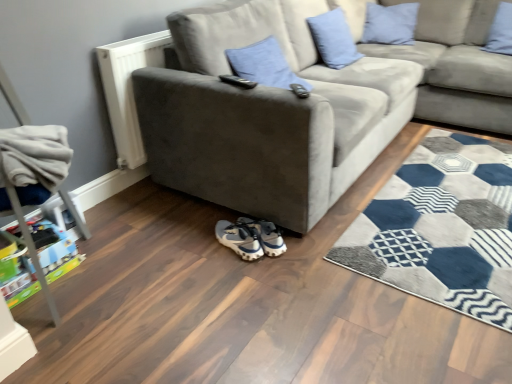
The image size is (512, 384). Describe the element at coordinates (264, 65) in the screenshot. I see `blue fabric pillow at upper center, arranged as the first pillow when viewed from the left` at that location.

Where is `blue fabric pillow at upper center, the fourth pillow viewed from the right`? This screenshot has width=512, height=384. blue fabric pillow at upper center, the fourth pillow viewed from the right is located at coordinates (264, 65).

The width and height of the screenshot is (512, 384). Find the location of `white matte radiator at left`. white matte radiator at left is located at coordinates (128, 89).

Where is `suede gray couch at center`? The height and width of the screenshot is (384, 512). suede gray couch at center is located at coordinates (309, 101).

Looking at this image, how much space does light blue fabric pillow at upper center, positioned as the third pillow in right-to-left order, occupy horizontally?

11.59 inches.

Locate an element on the screen. Image resolution: width=512 pixels, height=384 pixels. white fabric sandal at lower center, which ranks as the 1th footwear in left-to-right order is located at coordinates (239, 239).

Looking at their sizes, would you say light blue fabric pillow at upper center, arranged as the second pillow when viewed from the left, is wider or thinner than suede gray couch at upper right?

Clearly, light blue fabric pillow at upper center, arranged as the second pillow when viewed from the left, has less width compared to suede gray couch at upper right.

Can you confirm if light blue fabric pillow at upper center, arranged as the second pillow when viewed from the left, is smaller than suede gray couch at upper right?

Indeed, light blue fabric pillow at upper center, arranged as the second pillow when viewed from the left, has a smaller size compared to suede gray couch at upper right.

Is point (347, 38) farther from camera compared to point (482, 24)?

No.

Is blue fabric pillow at upper center, the fourth pillow viewed from the right, oriented towards black plastic remote control at upper center, acting as the 1th remote control starting from the left?

No, blue fabric pillow at upper center, the fourth pillow viewed from the right, is not oriented towards black plastic remote control at upper center, acting as the 1th remote control starting from the left.

Which object is thinner, blue fabric pillow at upper center, the fourth pillow viewed from the right, or black plastic remote control at upper center, the second remote control in the right-to-left sequence?

black plastic remote control at upper center, the second remote control in the right-to-left sequence.

I want to click on the 1st pillow to the right of the black plastic remote control at upper center, acting as the 1th remote control starting from the left, starting your count from the anchor, so click(x=264, y=65).

From the image's perspective, is blue fabric pillow at upper center, the fourth pillow viewed from the right, below black plastic remote control at upper center, the second remote control in the right-to-left sequence?

Actually, blue fabric pillow at upper center, the fourth pillow viewed from the right, appears above black plastic remote control at upper center, the second remote control in the right-to-left sequence, in the image.

From the image's perspective, is blue fabric pillow at upper center, the fourth pillow viewed from the right, on top of suede gray couch at center?

No, from the image's perspective, blue fabric pillow at upper center, the fourth pillow viewed from the right, is not on top of suede gray couch at center.

Which is more to the left, blue fabric pillow at upper center, arranged as the first pillow when viewed from the left, or suede gray couch at center?

From the viewer's perspective, blue fabric pillow at upper center, arranged as the first pillow when viewed from the left, appears more on the left side.

Is blue fabric pillow at upper center, the fourth pillow viewed from the right, not within suede gray couch at center?

No, blue fabric pillow at upper center, the fourth pillow viewed from the right, is not entirely external to suede gray couch at center.

How far apart are blue fabric pillow at upper center, arranged as the first pillow when viewed from the left, and suede gray couch at center?

blue fabric pillow at upper center, arranged as the first pillow when viewed from the left, and suede gray couch at center are 14.14 inches apart.

Based on the photo, from a real-world perspective, is blue fabric pillow at upper center, the fourth pillow viewed from the right, over suede gray couch at upper right?

Yes, from a real-world perspective, blue fabric pillow at upper center, the fourth pillow viewed from the right, is over suede gray couch at upper right

Where is `couch above the blue fabric pillow at upper center, the fourth pillow viewed from the right (from the image's perspective)`? This screenshot has width=512, height=384. couch above the blue fabric pillow at upper center, the fourth pillow viewed from the right (from the image's perspective) is located at coordinates (457, 65).

Can you confirm if blue fabric pillow at upper center, arranged as the first pillow when viewed from the left, is wider than suede gray couch at upper right?

No, blue fabric pillow at upper center, arranged as the first pillow when viewed from the left, is not wider than suede gray couch at upper right.

Are blue fabric pillow at upper center, the fourth pillow viewed from the right, and suede gray couch at upper right located far from each other?

blue fabric pillow at upper center, the fourth pillow viewed from the right, is positioned a significant distance from suede gray couch at upper right.

Between white fabric sandal at lower center, the 2th footwear viewed from the right, and plastic toy car at lower left, which one appears on the right side from the viewer's perspective?

From the viewer's perspective, white fabric sandal at lower center, the 2th footwear viewed from the right, appears more on the right side.

Is white fabric sandal at lower center, which ranks as the 1th footwear in left-to-right order, placed right next to plastic toy car at lower left?

No, white fabric sandal at lower center, which ranks as the 1th footwear in left-to-right order, is not with plastic toy car at lower left.

From a real-world perspective, starting from the suede gray couch at center, which pillow is the 4th one vertically above it? Please provide its 2D coordinates.

[(500, 31)]

From the picture: Considering the sizes of blue velvet pillow at upper right, the fourth pillow in the left-to-right sequence, and suede gray couch at center in the image, is blue velvet pillow at upper right, the fourth pillow in the left-to-right sequence, bigger or smaller than suede gray couch at center?

Clearly, blue velvet pillow at upper right, the fourth pillow in the left-to-right sequence, is smaller in size than suede gray couch at center.

Does point (492, 27) lie behind point (250, 210)?

Yes, it is behind point (250, 210).

Which of these two, blue velvet pillow at upper right, the 1th pillow in the right-to-left sequence, or suede gray couch at center, stands shorter?

blue velvet pillow at upper right, the 1th pillow in the right-to-left sequence, is shorter.

Which object is positioned more to the left, suede gray couch at center or black plastic remote control at upper center, acting as the 1th remote control starting from the left?

Positioned to the left is black plastic remote control at upper center, acting as the 1th remote control starting from the left.

Is suede gray couch at center oriented away from black plastic remote control at upper center, acting as the 1th remote control starting from the left?

No, suede gray couch at center's orientation is not away from black plastic remote control at upper center, acting as the 1th remote control starting from the left.

From a real-world perspective, which object stands above the other?

black plastic remote control at upper center, the second remote control in the right-to-left sequence.

Does suede gray couch at center have a lesser width compared to black plastic remote control at upper center, the second remote control in the right-to-left sequence?

In fact, suede gray couch at center might be wider than black plastic remote control at upper center, the second remote control in the right-to-left sequence.

In the image, there is a light blue fabric pillow at upper center, arranged as the second pillow when viewed from the left. Where is `couch below it (from a real-world perspective)`? This screenshot has height=384, width=512. couch below it (from a real-world perspective) is located at coordinates (457, 65).

Where is `remote control that is the 2nd object above the blue fabric pillow at upper center, arranged as the first pillow when viewed from the left (from a real-world perspective)`? remote control that is the 2nd object above the blue fabric pillow at upper center, arranged as the first pillow when viewed from the left (from a real-world perspective) is located at coordinates (238, 81).

Considering their positions, is blue fabric pillow at upper center, the fourth pillow viewed from the right, positioned further to blue velvet pillow at upper right, the 1th pillow in the right-to-left sequence, than plastic toy car at lower left?

plastic toy car at lower left.

Considering their positions, is white fabric sneakers at lower center, positioned as the 1th footwear in right-to-left order, positioned closer to suede gray couch at upper right than plastic toy car at lower left?

The object closer to suede gray couch at upper right is white fabric sneakers at lower center, positioned as the 1th footwear in right-to-left order.

Looking at the image, which one is located closer to light blue fabric pillow at upper center, positioned as the 2th pillow in right-to-left order, blue fabric pillow at upper center, the fourth pillow viewed from the right, or blue velvet pillow at upper right, the 1th pillow in the right-to-left sequence?

blue velvet pillow at upper right, the 1th pillow in the right-to-left sequence, is closer to light blue fabric pillow at upper center, positioned as the 2th pillow in right-to-left order.

When comparing their distances from white matte radiator at left, does plastic toy car at lower left or black plastic remote control at upper center, the second remote control viewed from the left, seem closer?

The object closer to white matte radiator at left is plastic toy car at lower left.

In the scene shown: When comparing their distances from plastic toy car at lower left, does white matte radiator at left or suede gray couch at upper right seem closer?

white matte radiator at left is closer to plastic toy car at lower left.

When comparing their distances from black plastic remote control at upper center, the second remote control in the right-to-left sequence, does black plastic remote control at upper center, the 1th remote control from the right, or white matte radiator at left seem further?

Among the two, white matte radiator at left is located further to black plastic remote control at upper center, the second remote control in the right-to-left sequence.

Looking at the image, which one is located further to light blue fabric pillow at upper center, arranged as the 3th pillow when viewed from the left, black plastic remote control at upper center, the 1th remote control from the right, or light blue fabric pillow at upper center, positioned as the third pillow in right-to-left order?

Among the two, black plastic remote control at upper center, the 1th remote control from the right, is located further to light blue fabric pillow at upper center, arranged as the 3th pillow when viewed from the left.

Based on their spatial positions, is blue velvet pillow at upper right, the fourth pillow in the left-to-right sequence, or suede gray couch at upper right further from blue fabric pillow at upper center, arranged as the first pillow when viewed from the left?

Based on the image, blue velvet pillow at upper right, the fourth pillow in the left-to-right sequence, appears to be further to blue fabric pillow at upper center, arranged as the first pillow when viewed from the left.

Locate an element on the screen. remote control between black plastic remote control at upper center, the second remote control in the right-to-left sequence, and suede gray couch at center is located at coordinates (298, 90).

I want to click on remote control located between black plastic remote control at upper center, the second remote control viewed from the left, and blue fabric pillow at upper center, the fourth pillow viewed from the right, in the depth direction, so click(238, 81).

Identify the location of radiator that lies between blue fabric pillow at upper center, arranged as the first pillow when viewed from the left, and white fabric sandal at lower center, which ranks as the 1th footwear in left-to-right order, from top to bottom. (128, 89).

You are a GUI agent. You are given a task and a screenshot of the screen. Output one action in this format:
    pyautogui.click(x=<x>, y=<y>)
    Task: Click on the radiator located between plastic toy car at lower left and suede gray couch at center in the left-right direction
    
    Given the screenshot: What is the action you would take?
    pyautogui.click(x=128, y=89)